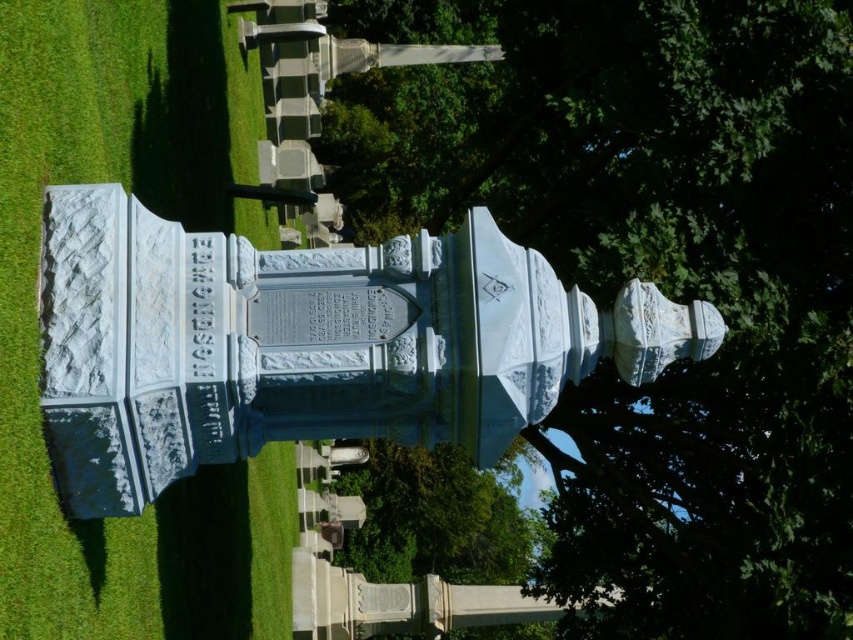
You are standing in the cemetery and want to take a photo of both the green leafy tree at upper center and the green leafy tree at center. Which tree should you focus on first to ensure both are in frame?

Focus on the green leafy tree at center first since it is shorter than the green leafy tree at upper center, allowing both to fit within the camera frame.

You are a landscape architect planning to install a new walkway between the white marble monument at center and the green leafy tree at center. The walkway requires a minimum of 60 meters of space. Can the walkway be placed between them?

The distance between the white marble monument at center and the green leafy tree at center is 63.50 meters, which exceeds the required 60 meters. Therefore, the walkway can be placed between them.

You are standing in front of the white marble monument in the cemetery. You want to take a photo of the monument with the green leafy tree at upper center in the background. Is the tree positioned to the left or right of the monument?

The green leafy tree at upper center is positioned to the right of the white marble monument because its 2D location at point (x=654, y=275) places it to the right side of the monument.